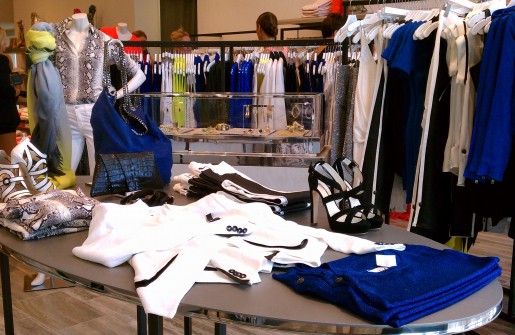
Find the location of `clothes folded`. clothes folded is located at coordinates (198, 258), (374, 274), (65, 218), (220, 179).